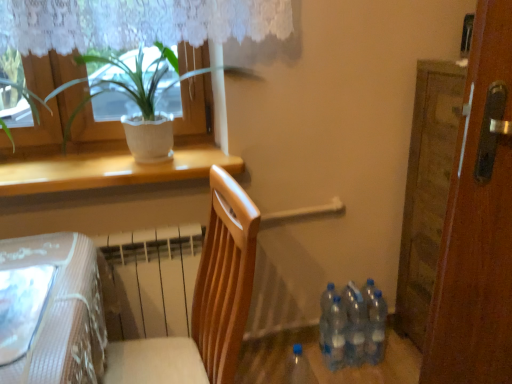
Question: From a real-world perspective, is transparent plastic bottles at lower right, the 2th bottle positioned from the left, located higher than blue translucent bottle at lower center, placed as the 5th bottle when sorted from right to left?

Choices:
 (A) no
 (B) yes

Answer: (B)

Question: Is blue translucent bottle at lower center, the 1th bottle from the left, located within transparent plastic bottles at lower right, which is counted as the fourth bottle, starting from the right?

Choices:
 (A) no
 (B) yes

Answer: (A)

Question: Can you confirm if transparent plastic bottles at lower right, the 2th bottle positioned from the left, is positioned to the right of blue translucent bottle at lower center, placed as the 5th bottle when sorted from right to left?

Choices:
 (A) no
 (B) yes

Answer: (B)

Question: Does transparent plastic bottles at lower right, the 2th bottle positioned from the left, have a greater height compared to blue translucent bottle at lower center, placed as the 5th bottle when sorted from right to left?

Choices:
 (A) no
 (B) yes

Answer: (A)

Question: Is the depth of transparent plastic bottles at lower right, which is counted as the fourth bottle, starting from the right, greater than that of blue translucent bottle at lower center, the 1th bottle from the left?

Choices:
 (A) yes
 (B) no

Answer: (A)

Question: Could you tell me if transparent plastic bottles at lower right, which is counted as the fourth bottle, starting from the right, is turned towards blue translucent bottle at lower center, placed as the 5th bottle when sorted from right to left?

Choices:
 (A) yes
 (B) no

Answer: (B)

Question: Is wooden door at right completely or partially inside white matte window sill at upper left?

Choices:
 (A) yes
 (B) no

Answer: (B)

Question: Is white matte window sill at upper left bigger than wooden door at right?

Choices:
 (A) no
 (B) yes

Answer: (A)

Question: Is white matte window sill at upper left to the left of wooden door at right from the viewer's perspective?

Choices:
 (A) no
 (B) yes

Answer: (B)

Question: Is white matte window sill at upper left directly adjacent to wooden door at right?

Choices:
 (A) no
 (B) yes

Answer: (A)

Question: Does white matte window sill at upper left come in front of wooden door at right?

Choices:
 (A) yes
 (B) no

Answer: (B)

Question: Is white matte window sill at upper left behind wooden door at right?

Choices:
 (A) no
 (B) yes

Answer: (B)

Question: Could you tell me if green leafy plant at upper left is facing blue translucent bottle at lower center, placed as the 5th bottle when sorted from right to left?

Choices:
 (A) no
 (B) yes

Answer: (A)